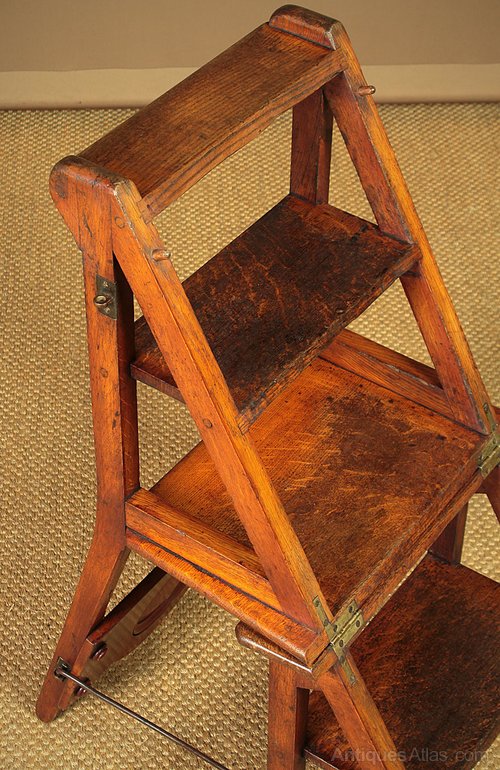
Image resolution: width=500 pixels, height=770 pixels. In order to click on rug in this screenshot , I will do `click(195, 671)`.